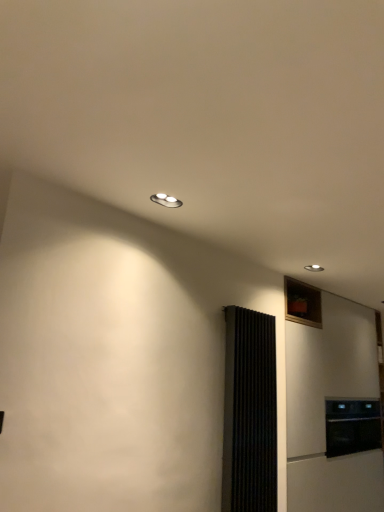
Where is `white matte refrigerator at right`? white matte refrigerator at right is located at coordinates (324, 408).

In the scene shown: Based on their sizes in the image, would you say black matte oven at lower right is bigger or smaller than white matte refrigerator at right?

black matte oven at lower right is smaller than white matte refrigerator at right.

From the picture: Would you say black matte oven at lower right is a long distance from white matte refrigerator at right?

black matte oven at lower right is near white matte refrigerator at right, not far away.

From a real-world perspective, is black matte oven at lower right physically below white matte refrigerator at right?

Yes.

From the image's perspective, between black matte oven at lower right and white matte refrigerator at right, which one is located above?

white matte refrigerator at right.

Is black ribbed screen door at right to the right of black matte oven at lower right from the viewer's perspective?

No, black ribbed screen door at right is not to the right of black matte oven at lower right.

Is black ribbed screen door at right next to black matte oven at lower right and touching it?

black ribbed screen door at right and black matte oven at lower right are clearly separated.

Does point (236, 480) come closer to viewer compared to point (377, 436)?

Yes, it is.

From the picture: Considering the relative sizes of white matte refrigerator at right and black matte oven at lower right in the image provided, is white matte refrigerator at right bigger than black matte oven at lower right?

Correct, white matte refrigerator at right is larger in size than black matte oven at lower right.

Image resolution: width=384 pixels, height=512 pixels. In order to click on appliance that is behind the white matte refrigerator at right in this screenshot , I will do `click(352, 426)`.

Is white matte refrigerator at right in front of or behind black matte oven at lower right in the image?

white matte refrigerator at right is positioned closer to the viewer than black matte oven at lower right.

From the image's perspective, does black ribbed screen door at right appear higher than white matte refrigerator at right?

Yes, from the image's perspective, black ribbed screen door at right is above white matte refrigerator at right.

Considering the positions of points (259, 335) and (366, 374), is point (259, 335) closer to camera compared to point (366, 374)?

Yes, it is.

Is black ribbed screen door at right far away from white matte refrigerator at right?

Actually, black ribbed screen door at right and white matte refrigerator at right are a little close together.

Where is `screen door on the left of white matte refrigerator at right`? This screenshot has width=384, height=512. screen door on the left of white matte refrigerator at right is located at coordinates tap(249, 413).

Is black ribbed screen door at right at the back of black matte oven at lower right?

black matte oven at lower right does not have its back to black ribbed screen door at right.

From a real-world perspective, who is located higher, black matte oven at lower right or black ribbed screen door at right?

black ribbed screen door at right.

How far apart are black matte oven at lower right and black ribbed screen door at right?

black matte oven at lower right is 4.32 feet from black ribbed screen door at right.

From the picture: Is black matte oven at lower right smaller than black ribbed screen door at right?

Incorrect, black matte oven at lower right is not smaller in size than black ribbed screen door at right.

At what (x,y) coordinates should I click in order to perform the action: click on screen door on the left of white matte refrigerator at right. Please return your answer as a coordinate pair (x, y). Looking at the image, I should click on (249, 413).

Is black ribbed screen door at right at the back of white matte refrigerator at right?

white matte refrigerator at right is not turned away from black ribbed screen door at right.

Considering the relative positions of white matte refrigerator at right and black ribbed screen door at right in the image provided, is white matte refrigerator at right to the left or to the right of black ribbed screen door at right?

Based on their positions, white matte refrigerator at right is located to the right of black ribbed screen door at right.

How many degrees apart are the facing directions of white matte refrigerator at right and black ribbed screen door at right?

0.389 degrees separate the facing orientations of white matte refrigerator at right and black ribbed screen door at right.

This screenshot has width=384, height=512. In order to click on fridge lying on the left of black matte oven at lower right in this screenshot , I will do `click(324, 408)`.

Where is `appliance behind the black ribbed screen door at right`? The image size is (384, 512). appliance behind the black ribbed screen door at right is located at coordinates (352, 426).

Based on the photo, which object lies further to the anchor point black ribbed screen door at right, white matte refrigerator at right or black matte oven at lower right?

Based on the image, black matte oven at lower right appears to be further to black ribbed screen door at right.

Based on their spatial positions, is white matte refrigerator at right or black ribbed screen door at right further from black matte oven at lower right?

Among the two, black ribbed screen door at right is located further to black matte oven at lower right.

From the image, which object appears to be nearer to white matte refrigerator at right, black matte oven at lower right or black ribbed screen door at right?

black matte oven at lower right is positioned closer to the anchor white matte refrigerator at right.

Looking at the image, which one is located closer to black ribbed screen door at right, black matte oven at lower right or white matte refrigerator at right?

white matte refrigerator at right.

Based on their spatial positions, is black ribbed screen door at right or white matte refrigerator at right closer to black matte oven at lower right?

white matte refrigerator at right is positioned closer to the anchor black matte oven at lower right.

Which object lies nearer to the anchor point white matte refrigerator at right, black ribbed screen door at right or black matte oven at lower right?

Based on the image, black matte oven at lower right appears to be nearer to white matte refrigerator at right.

Locate an element on the screen. The height and width of the screenshot is (512, 384). fridge between black ribbed screen door at right and black matte oven at lower right from front to back is located at coordinates (324, 408).